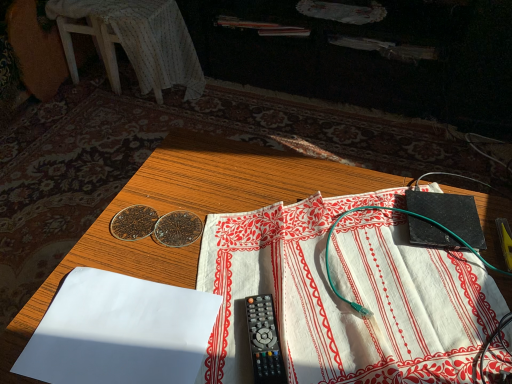
At what (x,y) coordinates should I click in order to perform the action: click on white cloth at center, acting as the 1th sheet starting from the right. Please return your answer as a coordinate pair (x, y). This screenshot has height=384, width=512. Looking at the image, I should click on (345, 295).

Could you measure the distance between wooden table at center and white cloth at center, acting as the 1th sheet starting from the right?

wooden table at center and white cloth at center, acting as the 1th sheet starting from the right, are 6.01 inches apart from each other.

Is wooden table at center taller than white cloth at center, which is counted as the second sheet, starting from the left?

Yes.

Is wooden table at center far from white cloth at center, acting as the 1th sheet starting from the right?

Actually, wooden table at center and white cloth at center, acting as the 1th sheet starting from the right, are a little close together.

Can you confirm if wooden table at center is bigger than white cloth at center, acting as the 1th sheet starting from the right?

Correct, wooden table at center is larger in size than white cloth at center, acting as the 1th sheet starting from the right.

Locate an element on the screen. This screenshot has height=384, width=512. table above the white fabric-covered stool at upper left (from a real-world perspective) is located at coordinates (187, 209).

In the scene shown: How much distance is there between white fabric-covered stool at upper left and wooden table at center?

white fabric-covered stool at upper left and wooden table at center are 4.11 feet apart from each other.

From a real-world perspective, which object rests below the other?

From a 3D spatial view, white fabric-covered stool at upper left is below.

From the image's perspective, is white fabric-covered stool at upper left above or below wooden table at center?

white fabric-covered stool at upper left is situated higher than wooden table at center in the image.

I want to click on stationery lying above the wooden table at center (from the image's perspective), so [264, 340].

Is wooden table at center oriented towards black plastic remote control at center?

No, wooden table at center is not aimed at black plastic remote control at center.

Which is more to the left, wooden table at center or black plastic remote control at center?

black plastic remote control at center.

Is white paper at lower left, the 2th sheet from the right, far from white cloth at center, which is counted as the second sheet, starting from the left?

No.

How different are the orientations of white paper at lower left, which appears as the 1th sheet when viewed from the left, and white cloth at center, which is counted as the second sheet, starting from the left, in degrees?

15.6 degrees separate the facing orientations of white paper at lower left, which appears as the 1th sheet when viewed from the left, and white cloth at center, which is counted as the second sheet, starting from the left.

From the image's perspective, which is below, white paper at lower left, which appears as the 1th sheet when viewed from the left, or white cloth at center, which is counted as the second sheet, starting from the left?

white paper at lower left, which appears as the 1th sheet when viewed from the left, appears lower in the image.

From the image's perspective, which is below, white paper at lower left, which appears as the 1th sheet when viewed from the left, or black plastic remote control at center?

black plastic remote control at center appears lower in the image.

Is white paper at lower left, the 2th sheet from the right, far away from black plastic remote control at center?

No, white paper at lower left, the 2th sheet from the right, is not far from black plastic remote control at center.

Between white paper at lower left, which appears as the 1th sheet when viewed from the left, and black plastic remote control at center, which one has larger size?

Bigger between the two is white paper at lower left, which appears as the 1th sheet when viewed from the left.

Is white fabric-covered stool at upper left far from white cloth at center, which is counted as the second sheet, starting from the left?

Yes.

Which point is more distant from viewer, (185, 35) or (305, 254)?

The point (185, 35) is farther.

From the image's perspective, is white fabric-covered stool at upper left positioned above or below white cloth at center, acting as the 1th sheet starting from the right?

white fabric-covered stool at upper left is situated higher than white cloth at center, acting as the 1th sheet starting from the right, in the image.

Is the position of white fabric-covered stool at upper left less distant than that of white cloth at center, which is counted as the second sheet, starting from the left?

No, it is not.

Where is `table on the right of white paper at lower left, which appears as the 1th sheet when viewed from the left`? The height and width of the screenshot is (384, 512). table on the right of white paper at lower left, which appears as the 1th sheet when viewed from the left is located at coordinates (187, 209).

Would you say white paper at lower left, the 2th sheet from the right, is outside wooden table at center?

Yes, white paper at lower left, the 2th sheet from the right, is outside of wooden table at center.

Is white paper at lower left, which appears as the 1th sheet when viewed from the left, facing away from wooden table at center?

No, white paper at lower left, which appears as the 1th sheet when viewed from the left, is not facing the opposite direction of wooden table at center.

Does white paper at lower left, which appears as the 1th sheet when viewed from the left, touch wooden table at center?

No, white paper at lower left, which appears as the 1th sheet when viewed from the left, is not beside wooden table at center.

This screenshot has width=512, height=384. Find the location of `sheet to the right of wooden table at center`. sheet to the right of wooden table at center is located at coordinates (345, 295).

At what (x,y) coordinates should I click in order to perform the action: click on furniture to the left of wooden table at center. Please return your answer as a coordinate pair (x, y). Image resolution: width=512 pixels, height=384 pixels. Looking at the image, I should click on (134, 41).

Based on their spatial positions, is black plastic remote control at center or white cloth at center, which is counted as the second sheet, starting from the left, closer to white fabric-covered stool at upper left?

white cloth at center, which is counted as the second sheet, starting from the left, is positioned closer to the anchor white fabric-covered stool at upper left.

When comparing their distances from white cloth at center, acting as the 1th sheet starting from the right, does white paper at lower left, which appears as the 1th sheet when viewed from the left, or wooden table at center seem closer?

wooden table at center is closer to white cloth at center, acting as the 1th sheet starting from the right.

Looking at this image, which object lies further to the anchor point black plastic remote control at center, white paper at lower left, which appears as the 1th sheet when viewed from the left, or white cloth at center, which is counted as the second sheet, starting from the left?

white paper at lower left, which appears as the 1th sheet when viewed from the left, is positioned further to the anchor black plastic remote control at center.

When comparing their distances from white cloth at center, which is counted as the second sheet, starting from the left, does black plastic remote control at center or white paper at lower left, the 2th sheet from the right, seem further?

white paper at lower left, the 2th sheet from the right, is further to white cloth at center, which is counted as the second sheet, starting from the left.

Based on their spatial positions, is wooden table at center or white paper at lower left, the 2th sheet from the right, closer to black plastic remote control at center?

Based on the image, white paper at lower left, the 2th sheet from the right, appears to be nearer to black plastic remote control at center.

Based on their spatial positions, is white paper at lower left, which appears as the 1th sheet when viewed from the left, or white fabric-covered stool at upper left closer to white cloth at center, which is counted as the second sheet, starting from the left?

Among the two, white paper at lower left, which appears as the 1th sheet when viewed from the left, is located nearer to white cloth at center, which is counted as the second sheet, starting from the left.

Looking at the image, which one is located closer to white cloth at center, which is counted as the second sheet, starting from the left, white fabric-covered stool at upper left or black plastic remote control at center?

black plastic remote control at center lies closer to white cloth at center, which is counted as the second sheet, starting from the left, than the other object.

Which object lies further to the anchor point black plastic remote control at center, white cloth at center, which is counted as the second sheet, starting from the left, or wooden table at center?

wooden table at center is positioned further to the anchor black plastic remote control at center.

Identify the location of stationery between white cloth at center, acting as the 1th sheet starting from the right, and white fabric-covered stool at upper left, along the z-axis. The width and height of the screenshot is (512, 384). (264, 340).

Locate an element on the screen. stationery between wooden table at center and white fabric-covered stool at upper left in the front-back direction is located at coordinates (264, 340).

Where is `stationery between white paper at lower left, the 2th sheet from the right, and white fabric-covered stool at upper left in the front-back direction`? This screenshot has height=384, width=512. stationery between white paper at lower left, the 2th sheet from the right, and white fabric-covered stool at upper left in the front-back direction is located at coordinates (x=264, y=340).

At what (x,y) coordinates should I click in order to perform the action: click on sheet between white cloth at center, which is counted as the second sheet, starting from the left, and white fabric-covered stool at upper left, along the z-axis. Please return your answer as a coordinate pair (x, y). Image resolution: width=512 pixels, height=384 pixels. Looking at the image, I should click on (119, 332).